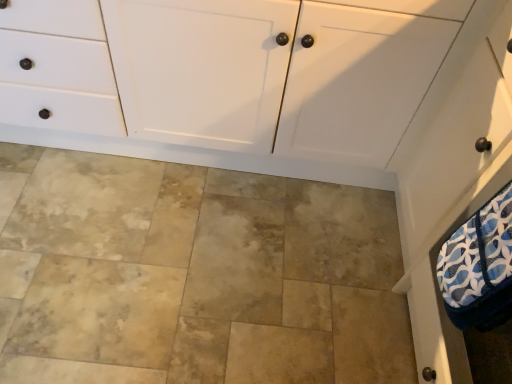
Find the location of `white matte cabinet at center`. white matte cabinet at center is located at coordinates (278, 72).

Describe the element at coordinates (278, 72) in the screenshot. I see `white matte cabinet at center` at that location.

What is the approximate height of white matte cabinet at center?

white matte cabinet at center is 31.85 inches tall.

In order to click on white matte cabinet at center in this screenshot , I will do `click(278, 72)`.